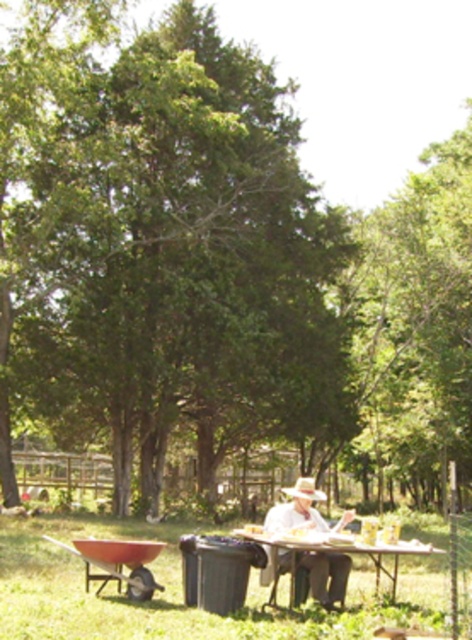
Question: Does white clothed person at center appear on the right side of white plastic table at center?

Choices:
 (A) yes
 (B) no

Answer: (A)

Question: Can you confirm if green leafy tree at center is bigger than white plastic table at center?

Choices:
 (A) no
 (B) yes

Answer: (B)

Question: Is green leafy tree at center thinner than white clothed person at center?

Choices:
 (A) yes
 (B) no

Answer: (B)

Question: Which point is farther to the camera?

Choices:
 (A) green grass at lower center
 (B) white clothed person at center
 (C) white straw hat at center

Answer: (B)

Question: Which object is the closest to the white clothed person at center?

Choices:
 (A) green leafy tree at center
 (B) white plastic table at center
 (C) white straw hat at center
 (D) green grass at lower center

Answer: (B)

Question: Which of the following is the closest to the observer?

Choices:
 (A) (285, 545)
 (B) (5, 579)
 (C) (345, 513)
 (D) (298, 493)

Answer: (A)